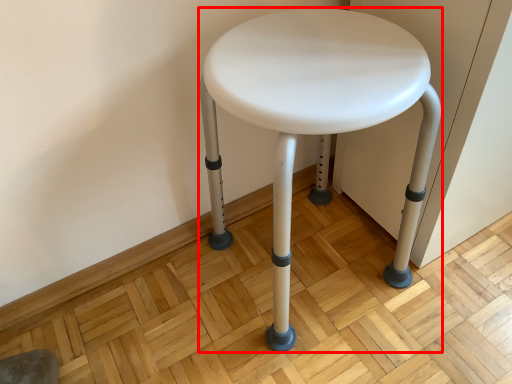
Question: From the image's perspective, where is stool (annotated by the red box) located relative to swivel chair?

Choices:
 (A) above
 (B) below

Answer: (A)